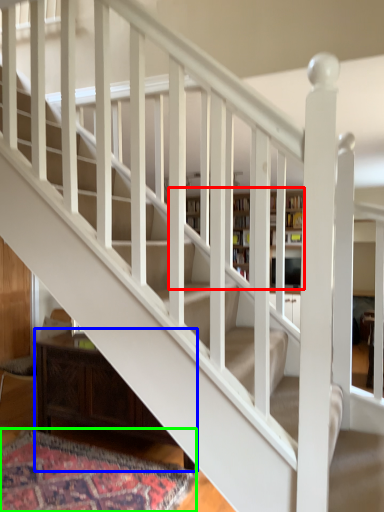
Question: Considering the real-world distances, which object is farthest from bookcase (highlighted by a red box)? furniture (highlighted by a blue box) or mat (highlighted by a green box)?

Choices:
 (A) furniture
 (B) mat

Answer: (B)